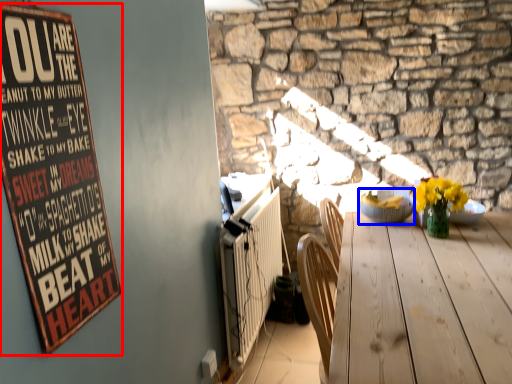
Question: Which object appears farthest to the camera in this image, bulletin board (highlighted by a red box) or bowl (highlighted by a blue box)?

Choices:
 (A) bulletin board
 (B) bowl

Answer: (B)